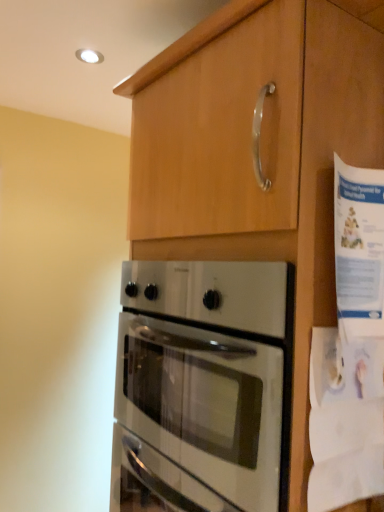
Question: Considering the relative sizes of satin silver oven at center and white paper at right in the image provided, is satin silver oven at center smaller than white paper at right?

Choices:
 (A) yes
 (B) no

Answer: (B)

Question: From a real-world perspective, does satin silver oven at center stand above white paper at right?

Choices:
 (A) yes
 (B) no

Answer: (B)

Question: Does satin silver oven at center have a larger size compared to white paper at right?

Choices:
 (A) no
 (B) yes

Answer: (B)

Question: From the image's perspective, is satin silver oven at center below white paper at right?

Choices:
 (A) no
 (B) yes

Answer: (B)

Question: Can you confirm if satin silver oven at center is positioned to the left of white paper at right?

Choices:
 (A) yes
 (B) no

Answer: (A)

Question: Is white paper at right taller or shorter than matte wood cabinet at upper center?

Choices:
 (A) short
 (B) tall

Answer: (A)

Question: Looking at the image, does white paper at right seem bigger or smaller compared to matte wood cabinet at upper center?

Choices:
 (A) big
 (B) small

Answer: (B)

Question: Is white paper at right to the left or to the right of matte wood cabinet at upper center in the image?

Choices:
 (A) left
 (B) right

Answer: (B)

Question: In the image, is white paper at right positioned in front of or behind matte wood cabinet at upper center?

Choices:
 (A) behind
 (B) front

Answer: (A)

Question: Does point (150, 109) appear closer or farther from the camera than point (178, 278)?

Choices:
 (A) closer
 (B) farther

Answer: (B)

Question: Is matte wood cabinet at upper center inside or outside of satin silver oven at center?

Choices:
 (A) inside
 (B) outside

Answer: (A)

Question: Relative to satin silver oven at center, is matte wood cabinet at upper center in front or behind?

Choices:
 (A) front
 (B) behind

Answer: (A)

Question: In terms of height, does matte wood cabinet at upper center look taller or shorter compared to satin silver oven at center?

Choices:
 (A) short
 (B) tall

Answer: (B)

Question: In terms of height, does satin silver oven at center look taller or shorter compared to matte wood cabinet at upper center?

Choices:
 (A) tall
 (B) short

Answer: (B)

Question: From the image's perspective, is satin silver oven at center positioned above or below matte wood cabinet at upper center?

Choices:
 (A) above
 (B) below

Answer: (B)